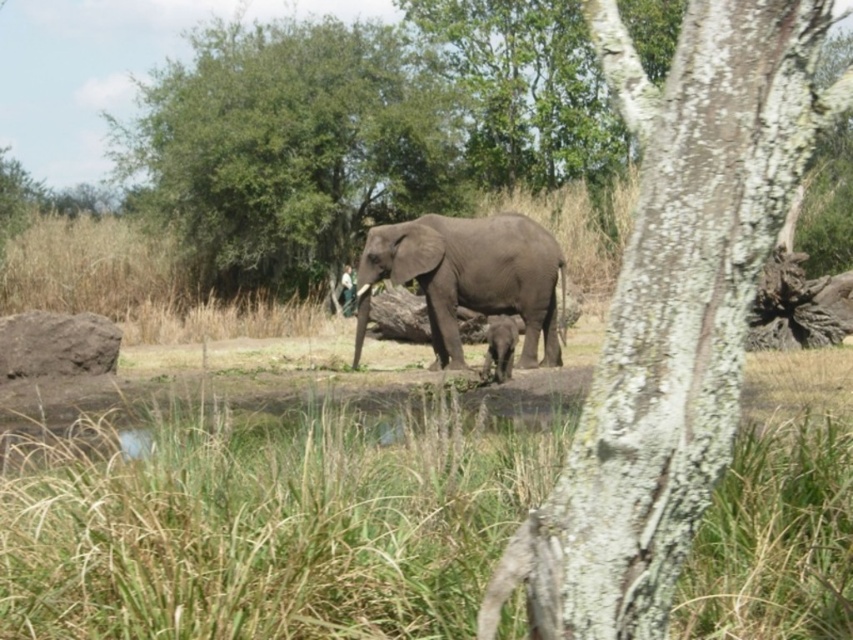
You are a safari guide leading a tour and want to point out both the gray matte elephant at center and the green leafy tree at center to your guests. Which one is closer to the front of the image?

The green leafy tree at center is closer to the front because the gray matte elephant at center is positioned behind it.

You are an animal researcher observing the gray rough bark tree trunk at center and the gray matte baby elephant at center in the savanna. Which object is closer to the observer?

The gray rough bark tree trunk at center is closer to the observer because it is positioned over the gray matte baby elephant at center, indicating it is in front.

You are a wildlife photographer aiming to capture a photo of both the gray matte elephant at center and the gray matte baby elephant at center. If your camera can only focus on objects within a 3 meter width, will you need to adjust your camera settings to include both?

The gray matte elephant at center is wider than the gray matte baby elephant at center. Since the camera can focus on objects within a 3 meter width, you need to check if the combined width of both elephants exceeds 3 meters. However, the description only provides their relative sizes, not exact measurements. Without specific width data, it is impossible to determine if adjustment is needed.